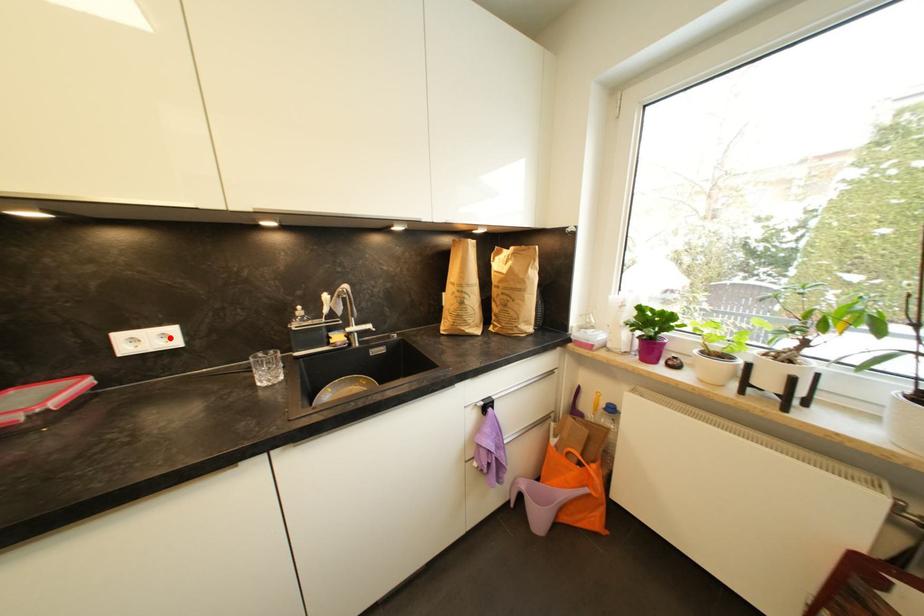
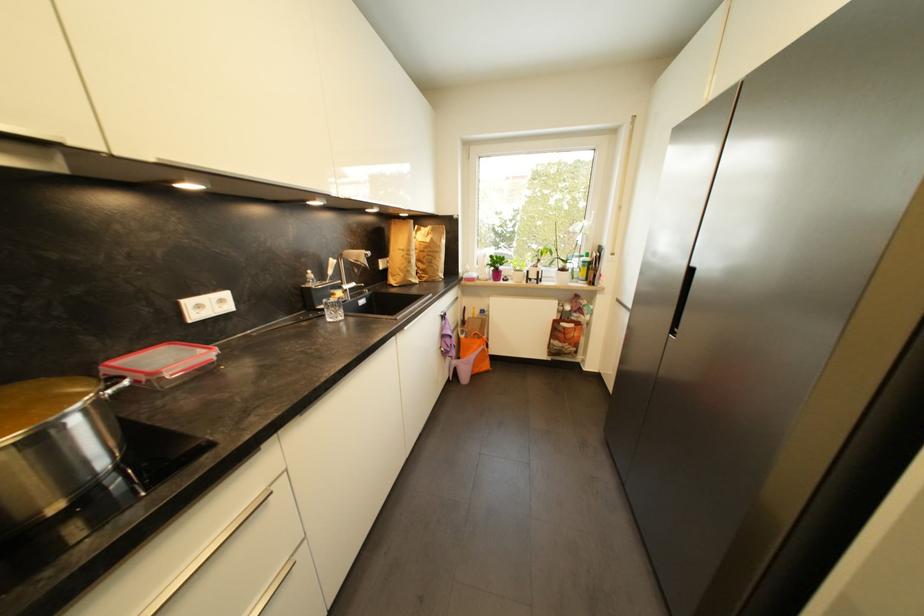
Question: I am providing you with two images of the same scene from different viewpoints. A red point is marked on the first image. Can you still see the location of the red point in image 2?

Choices:
 (A) Yes
 (B) No

Answer: (A)